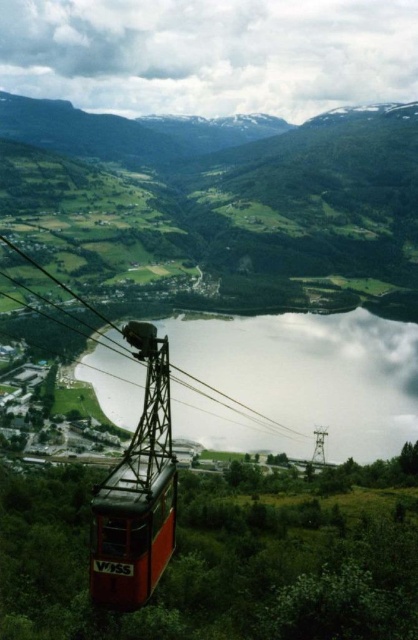
You are a pilot flying a small airplane and want to avoid the white fluffy cloud at upper center. Given that your plane can only safely fly up to 600 meters above the ground, is the cloud at a safe distance for you to navigate around?

The white fluffy cloud at upper center is 655.11 meters from the viewer, which exceeds the plane maximum safe altitude of 600 meters. Therefore, the cloud is not at a safe distance for navigation.

You are a tourist in the cable car and want to take a photo of the smooth reflective water at center. Where should you aim your camera to capture it?

You should aim your camera at point [297,381] to capture the smooth reflective water at center.